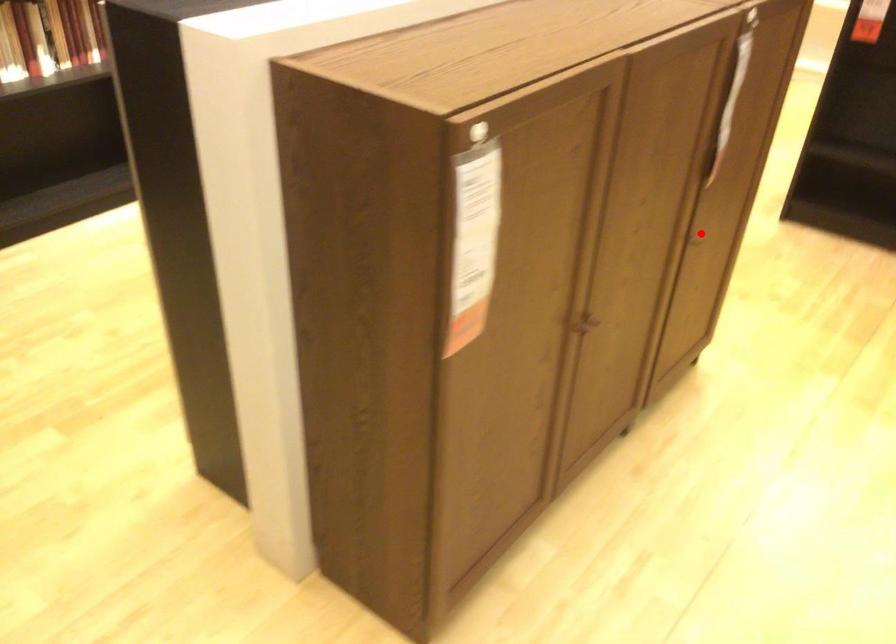
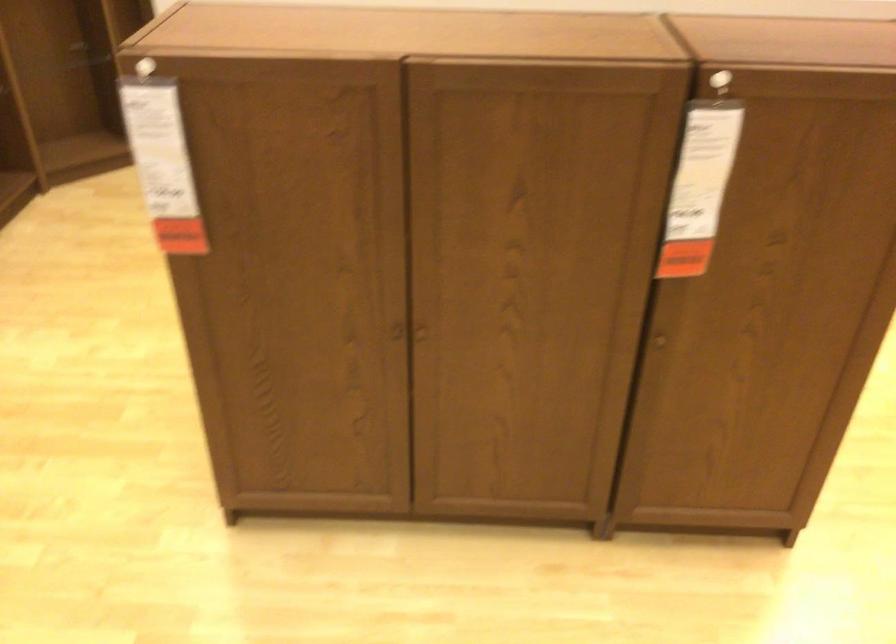
Question: I am providing you with two images of the same scene from different viewpoints. Image1 has a red point marked. In image2, the corresponding 3D location appears at what relative position? Reply with the corresponding letter.

Choices:
 (A) Closer
 (B) Farther

Answer: (A)